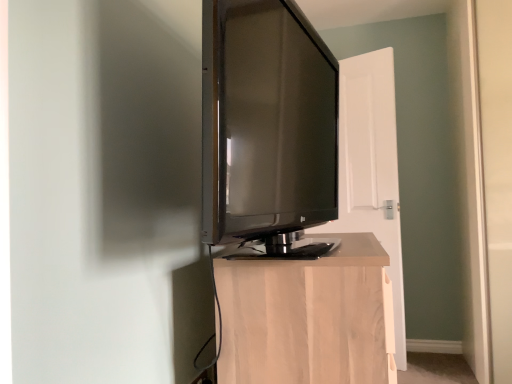
Question: Does light wood cabinet at center have a greater width compared to matte black tv at center?

Choices:
 (A) no
 (B) yes

Answer: (B)

Question: Does light wood cabinet at center appear on the right side of matte black tv at center?

Choices:
 (A) no
 (B) yes

Answer: (B)

Question: Is light wood cabinet at center far from matte black tv at center?

Choices:
 (A) yes
 (B) no

Answer: (B)

Question: Does light wood cabinet at center contain matte black tv at center?

Choices:
 (A) no
 (B) yes

Answer: (A)

Question: Is light wood cabinet at center closer to camera compared to matte black tv at center?

Choices:
 (A) yes
 (B) no

Answer: (B)

Question: Is light wood cabinet at center positioned behind matte black tv at center?

Choices:
 (A) yes
 (B) no

Answer: (A)

Question: Is matte black tv at center at the left side of light wood cabinet at center?

Choices:
 (A) yes
 (B) no

Answer: (A)

Question: Is matte black tv at center at the right side of light wood cabinet at center?

Choices:
 (A) yes
 (B) no

Answer: (B)

Question: From the image's perspective, is matte black tv at center on top of light wood cabinet at center?

Choices:
 (A) yes
 (B) no

Answer: (A)

Question: Is matte black tv at center further to camera compared to light wood cabinet at center?

Choices:
 (A) no
 (B) yes

Answer: (A)

Question: Considering the relative sizes of matte black tv at center and light wood cabinet at center in the image provided, is matte black tv at center taller than light wood cabinet at center?

Choices:
 (A) no
 (B) yes

Answer: (B)

Question: From a real-world perspective, is matte black tv at center positioned under light wood cabinet at center based on gravity?

Choices:
 (A) no
 (B) yes

Answer: (A)

Question: Is white wood door at center located outside matte black tv at center?

Choices:
 (A) yes
 (B) no

Answer: (A)